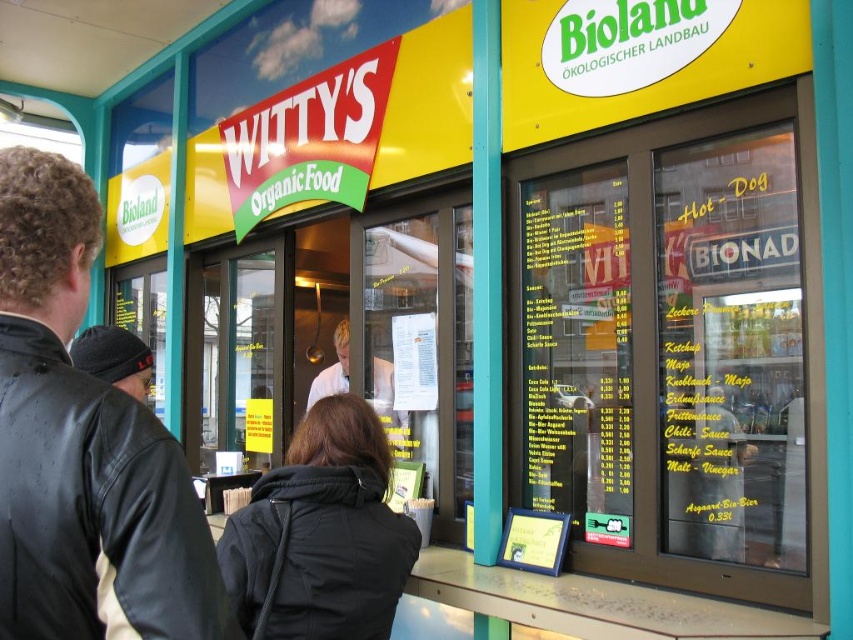
Is white paper menu at center below white uniform at center?

Actually, white paper menu at center is above white uniform at center.

Find the location of a particular element. Image resolution: width=853 pixels, height=640 pixels. white paper menu at center is located at coordinates (415, 362).

Between leather jacket at left and black fabric jacket at center, which one appears on the left side from the viewer's perspective?

leather jacket at left is more to the left.

I want to click on leather jacket at left, so click(83, 448).

Does leather jacket at left appear on the left side of white uniform at center?

In fact, leather jacket at left is to the right of white uniform at center.

Can you confirm if leather jacket at left is positioned above white uniform at center?

Yes, leather jacket at left is above white uniform at center.

Is point (131, 532) positioned behind point (306, 401)?

That is False.

This screenshot has width=853, height=640. In order to click on leather jacket at left in this screenshot , I will do pyautogui.click(x=83, y=448).